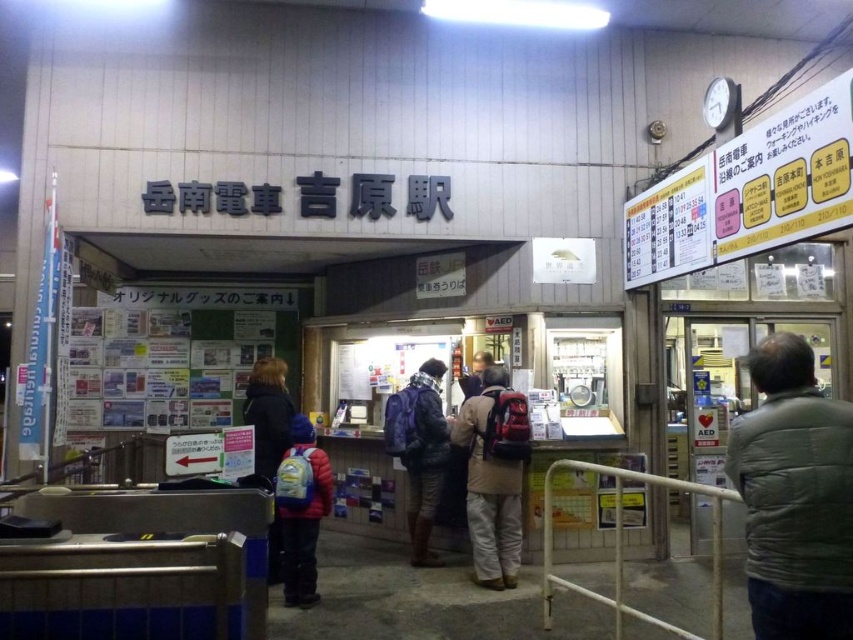
Question: Which object is closer to the camera taking this photo?

Choices:
 (A) matte blue backpack at center
 (B) green quilted jacket at right
 (C) matte blue backpack at lower left

Answer: (B)

Question: Does green quilted jacket at right appear on the left side of matte blue backpack at center?

Choices:
 (A) yes
 (B) no

Answer: (B)

Question: Among these points, which one is farthest from the camera?

Choices:
 (A) (804, 580)
 (B) (322, 508)
 (C) (251, 372)

Answer: (C)

Question: Where is matte brown backpack at center located in relation to dark blue jacket at left in the image?

Choices:
 (A) left
 (B) right

Answer: (B)

Question: In this image, where is matte blue backpack at center located relative to dark blue jacket at left?

Choices:
 (A) right
 (B) left

Answer: (A)

Question: Which of the following is the farthest from the observer?

Choices:
 (A) matte brown backpack at center
 (B) green quilted jacket at right

Answer: (A)